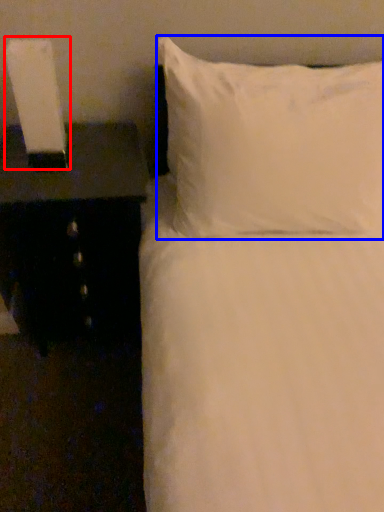
Question: Which object appears farthest to the camera in this image, bedside lamp (highlighted by a red box) or pillow (highlighted by a blue box)?

Choices:
 (A) bedside lamp
 (B) pillow

Answer: (A)